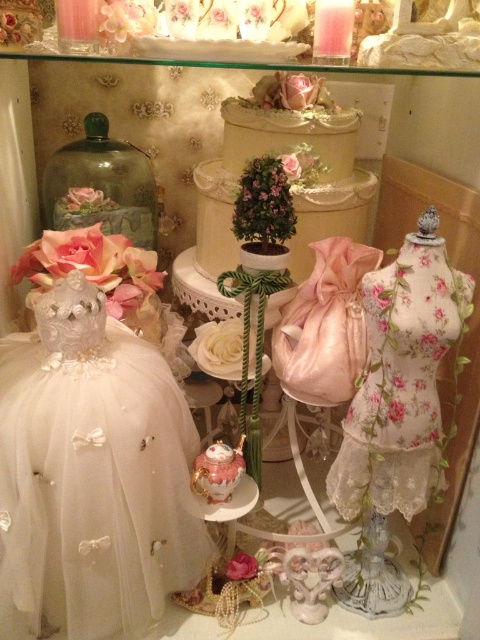
Question: Which of the following is the farthest from the observer?

Choices:
 (A) white tulle dress at left
 (B) floral lace dress at center

Answer: (B)

Question: Where is white tulle dress at left located in relation to floral lace dress at center in the image?

Choices:
 (A) below
 (B) above

Answer: (A)

Question: Can you confirm if white tulle dress at left is bigger than floral lace dress at center?

Choices:
 (A) yes
 (B) no

Answer: (A)

Question: Is white tulle dress at left above floral lace dress at center?

Choices:
 (A) yes
 (B) no

Answer: (B)